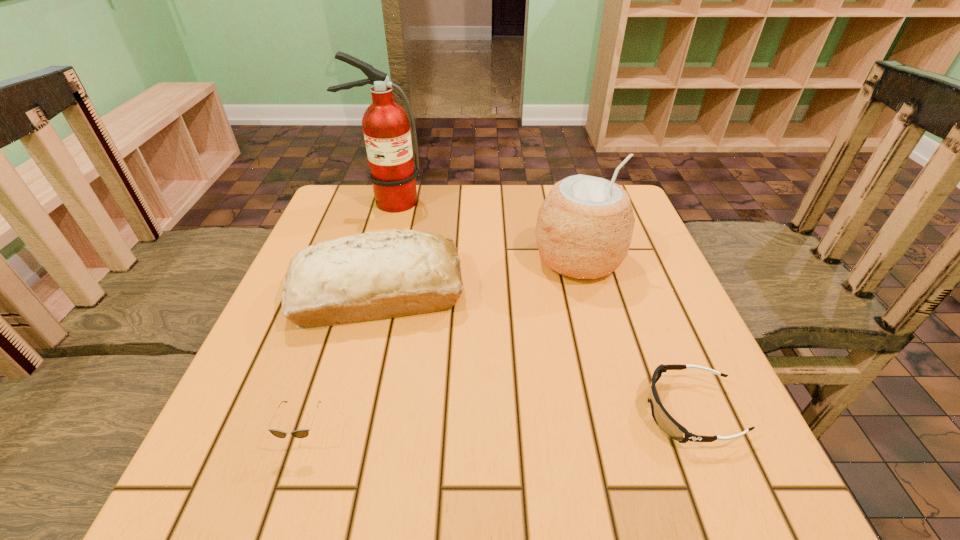
Find the location of a particular element. The height and width of the screenshot is (540, 960). goggles that is at the right edge is located at coordinates (663, 419).

The height and width of the screenshot is (540, 960). In order to click on object that is at the far left corner in this screenshot , I will do `click(386, 126)`.

The width and height of the screenshot is (960, 540). Identify the location of object situated at the near left corner. (302, 433).

Where is `object present at the near right corner`? This screenshot has height=540, width=960. object present at the near right corner is located at coordinates (663, 419).

Identify the location of free location at the far edge of the desktop. The image size is (960, 540). (403, 214).

In the image, there is a desktop. At what (x,y) coordinates should I click in order to perform the action: click on vacant area at the near edge. Please return your answer as a coordinate pair (x, y). Looking at the image, I should click on [x=515, y=480].

Find the location of a particular element. The width and height of the screenshot is (960, 540). vacant area at the left edge is located at coordinates pos(350,234).

Locate an element on the screen. free space at the right edge is located at coordinates (707, 427).

Identify the location of free region at the far left corner of the desktop. This screenshot has width=960, height=540. (369, 217).

Find the location of `vacant space that is in between the goggles and the third tallest object`. vacant space that is in between the goggles and the third tallest object is located at coordinates (534, 352).